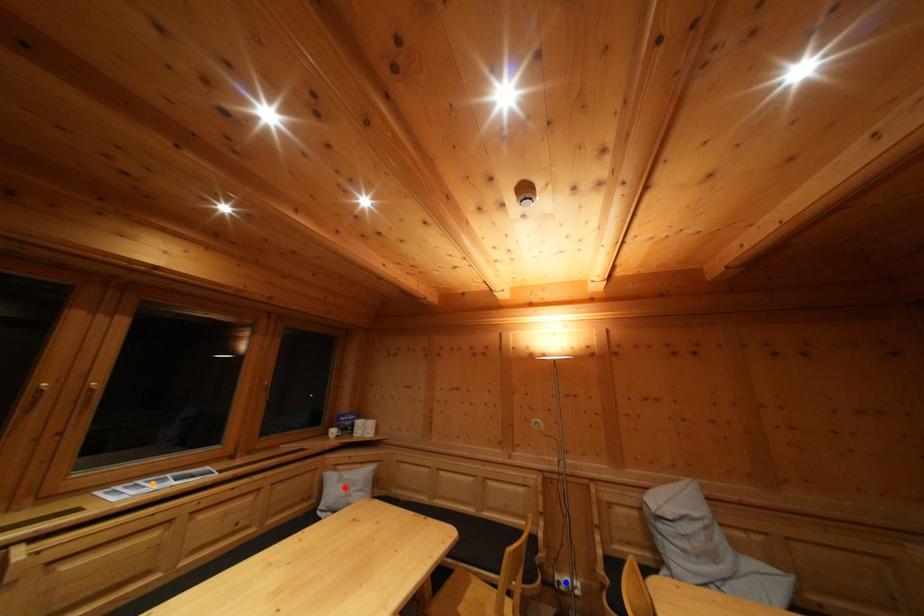
From the picture: Order these from nearest to farthest:
red point
blue point
orange point

orange point < blue point < red point